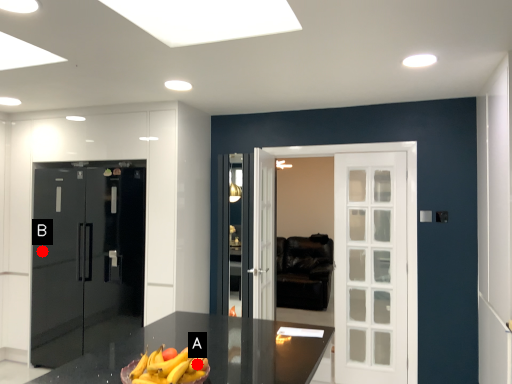
Question: Two points are circled on the image, labeled by A and B beside each circle. Which of the following is the closest to the observer?

Choices:
 (A) A is closer
 (B) B is closer

Answer: (A)